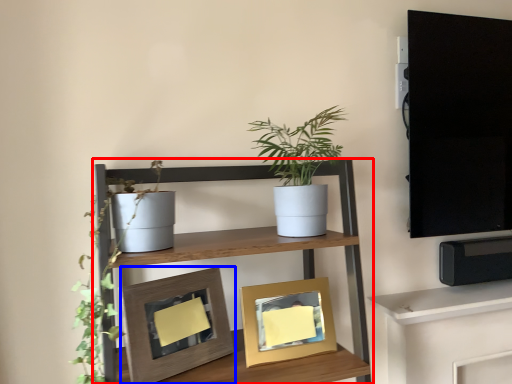
Question: Among these objects, which one is nearest to the camera, shelf (highlighted by a red box) or picture frame (highlighted by a blue box)?

Choices:
 (A) shelf
 (B) picture frame

Answer: (A)